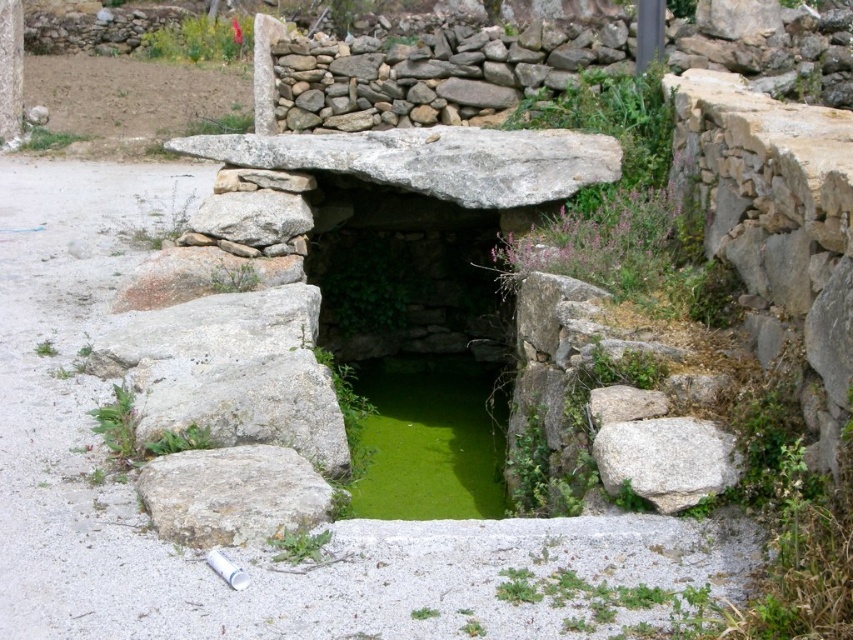
Question: Is green algae at center behind gray rough stone at lower left?

Choices:
 (A) no
 (B) yes

Answer: (B)

Question: Which of the following is the closest to the observer?

Choices:
 (A) (173, 461)
 (B) (373, 436)
 (C) (619, 426)

Answer: (C)

Question: Is gray rough stone at lower left below gray rough rock at right?

Choices:
 (A) yes
 (B) no

Answer: (A)

Question: In this image, where is gray rough stone at lower left located relative to gray rough rock at right?

Choices:
 (A) above
 (B) below

Answer: (B)

Question: Among these objects, which one is farthest from the camera?

Choices:
 (A) green algae at center
 (B) gray rough rock at right
 (C) gray rough stone at lower left

Answer: (A)

Question: Which point is closer to the camera?

Choices:
 (A) (368, 368)
 (B) (154, 474)
 (C) (703, 490)

Answer: (C)